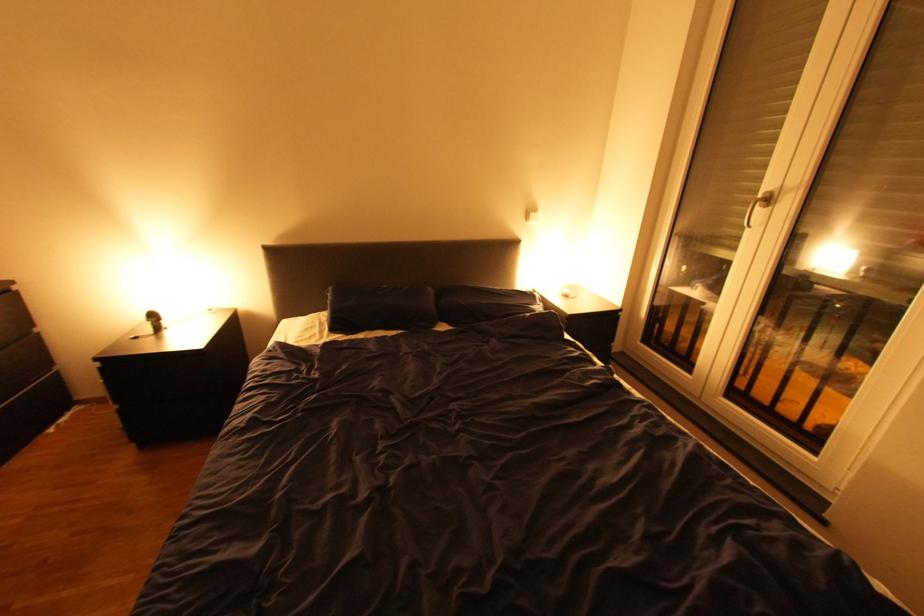
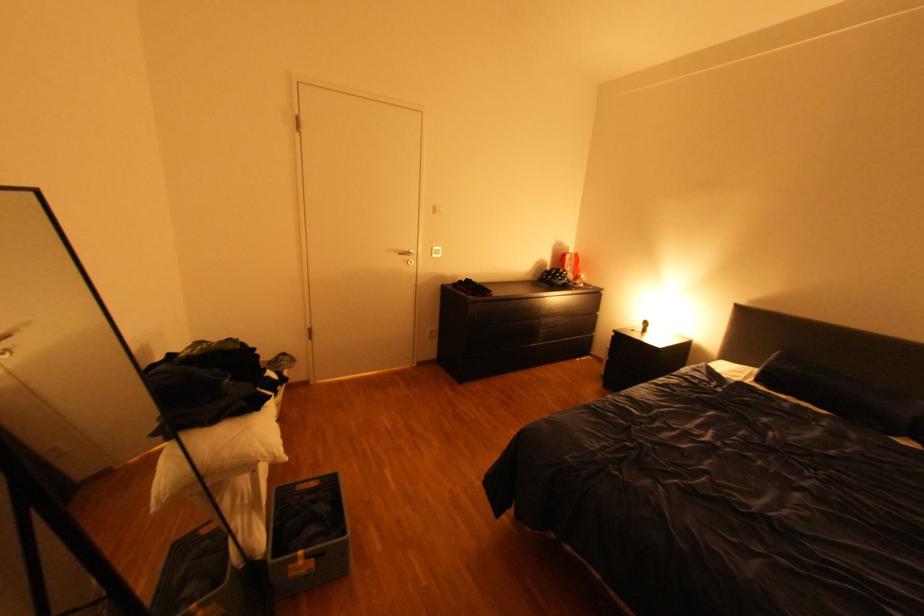
Locate, in the second image, the point that corresponds to point 348,334 in the first image.

(771, 387)